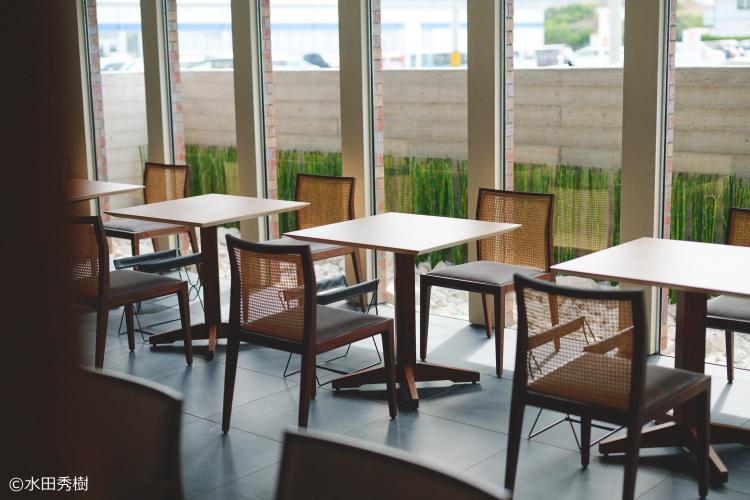
Where is `chairs`? chairs is located at coordinates (91, 256), (165, 176), (262, 288), (333, 194), (532, 224), (586, 347), (733, 218), (126, 427), (310, 454).